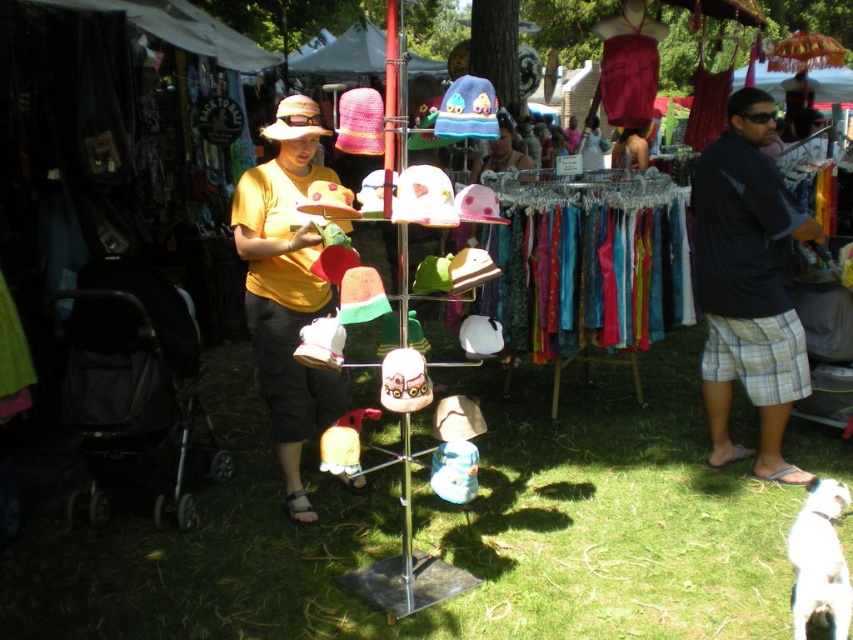
Question: Can you confirm if yellow matte shirt at center is positioned below white fur dog at lower right?

Choices:
 (A) yes
 (B) no

Answer: (B)

Question: Observing the image, what is the correct spatial positioning of yellow matte shirt at center in reference to matte pink hat at center?

Choices:
 (A) right
 (B) left

Answer: (B)

Question: Which point is farther to the camera?

Choices:
 (A) (480, 160)
 (B) (724, 449)
 (C) (256, 243)
 (D) (822, 573)

Answer: (A)

Question: Which point appears closest to the camera in this image?

Choices:
 (A) (485, 157)
 (B) (704, 237)
 (C) (837, 568)
 (D) (302, 388)

Answer: (C)

Question: Is white fur dog at lower right further to camera compared to matte pink hat at center?

Choices:
 (A) yes
 (B) no

Answer: (B)

Question: Which point is farther to the camera?

Choices:
 (A) (746, 305)
 (B) (503, 132)
 (C) (819, 541)
 (D) (265, 193)

Answer: (B)